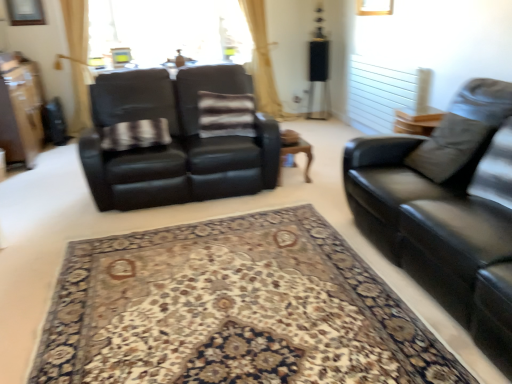
This screenshot has width=512, height=384. What are the coordinates of `free space in front of wooden coffee table at center` in the screenshot? It's located at pyautogui.click(x=288, y=188).